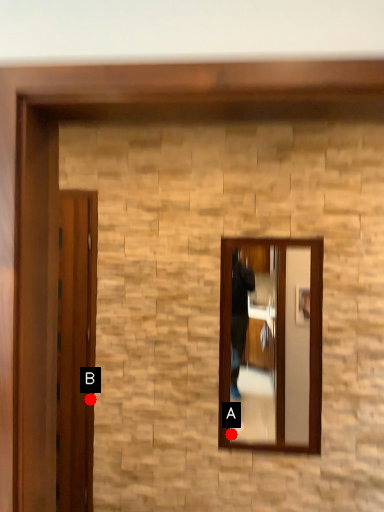
Question: Two points are circled on the image, labeled by A and B beside each circle. Among these points, which one is farthest from the camera?

Choices:
 (A) A is further
 (B) B is further

Answer: (A)